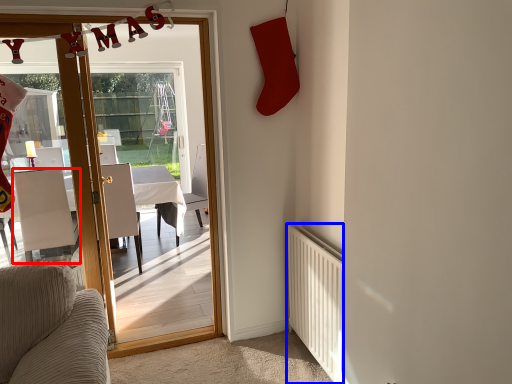
Question: Which object appears farthest to the camera in this image, chair (highlighted by a red box) or radiator (highlighted by a blue box)?

Choices:
 (A) chair
 (B) radiator

Answer: (A)